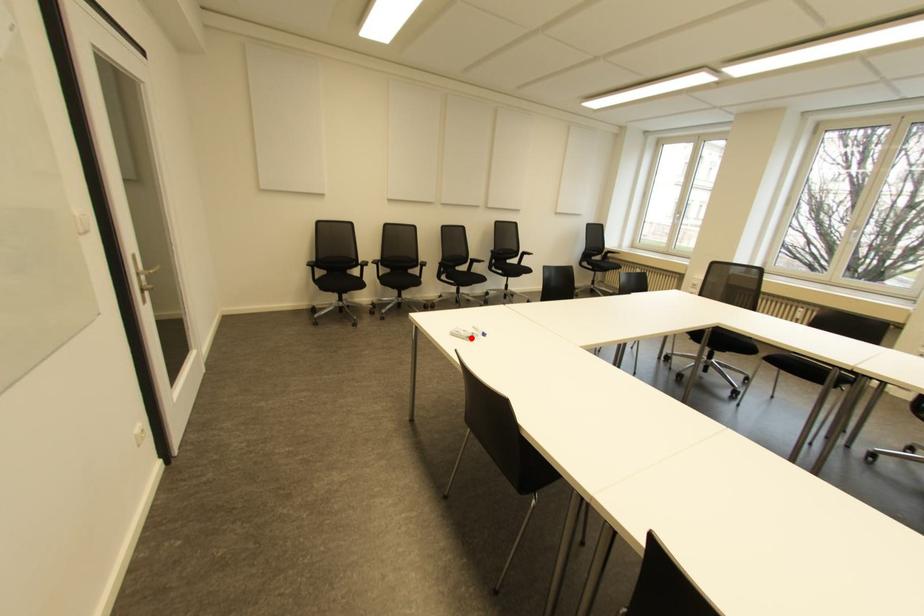
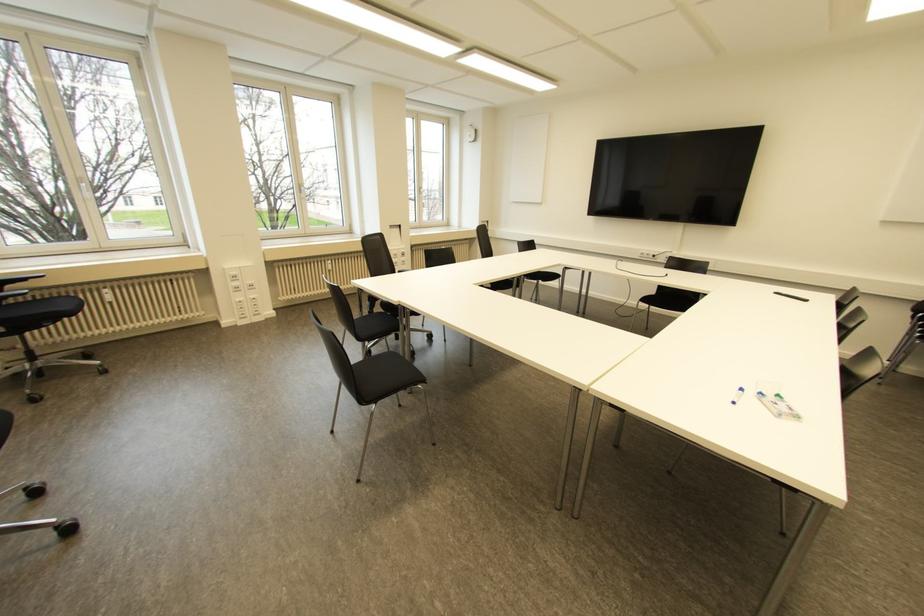
Where in the second image is the point corresponding to the highlighted location from the first image?

(777, 395)